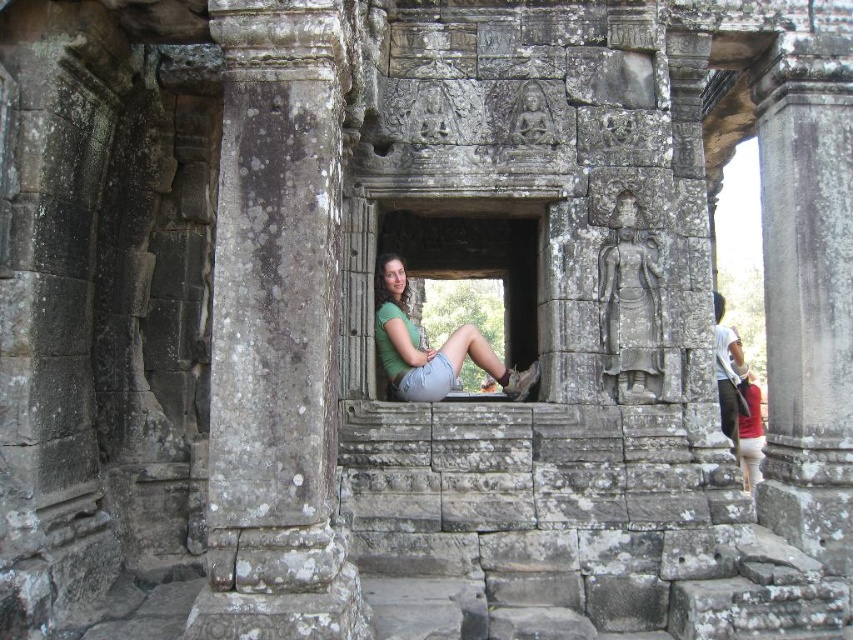
Between gray stone column at left and white cotton shirt at center, which one is positioned higher?

gray stone column at left is higher up.

Looking at this image, does gray stone column at left have a lesser width compared to white cotton shirt at center?

No.

Between point (244, 4) and point (718, 316), which one is positioned behind?

The point (718, 316) is more distant.

Where is `gray stone column at left`? gray stone column at left is located at coordinates (276, 332).

Which of these two, green fabric shirt at center or white cotton shirt at center, stands shorter?

green fabric shirt at center is shorter.

Locate an element on the screen. green fabric shirt at center is located at coordinates (431, 348).

Who is more distant from viewer, (x=376, y=268) or (x=720, y=380)?

The point (x=720, y=380) is more distant.

Locate an element on the screen. This screenshot has height=640, width=853. green fabric shirt at center is located at coordinates (431, 348).

Between gray stone pillar at upper right and white cotton shirt at center, which one is positioned higher?

gray stone pillar at upper right is higher up.

Which is more to the left, gray stone pillar at upper right or white cotton shirt at center?

From the viewer's perspective, gray stone pillar at upper right appears more on the left side.

Which is in front, point (817, 285) or point (723, 392)?

Point (817, 285)

This screenshot has height=640, width=853. What are the coordinates of `gray stone pillar at upper right` in the screenshot? It's located at (807, 291).